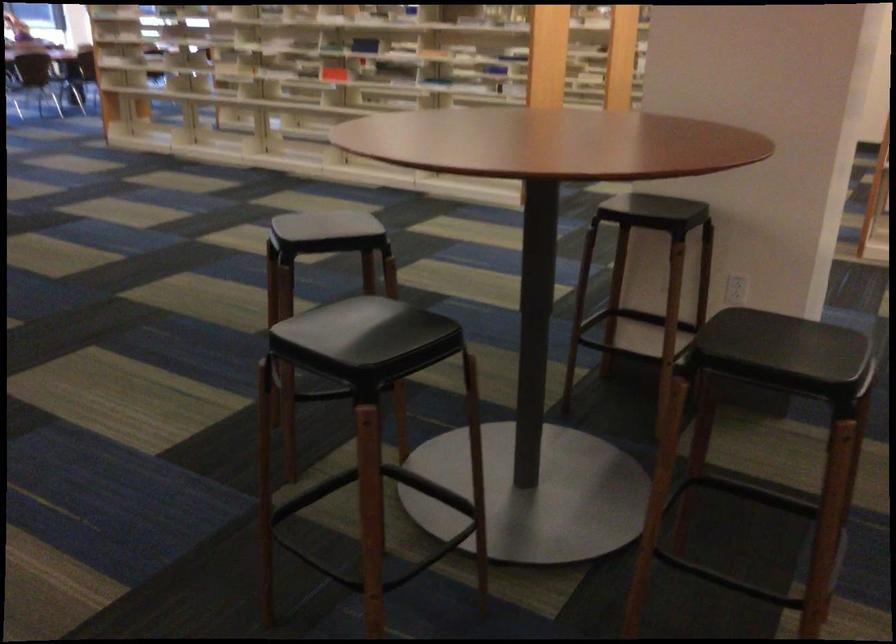
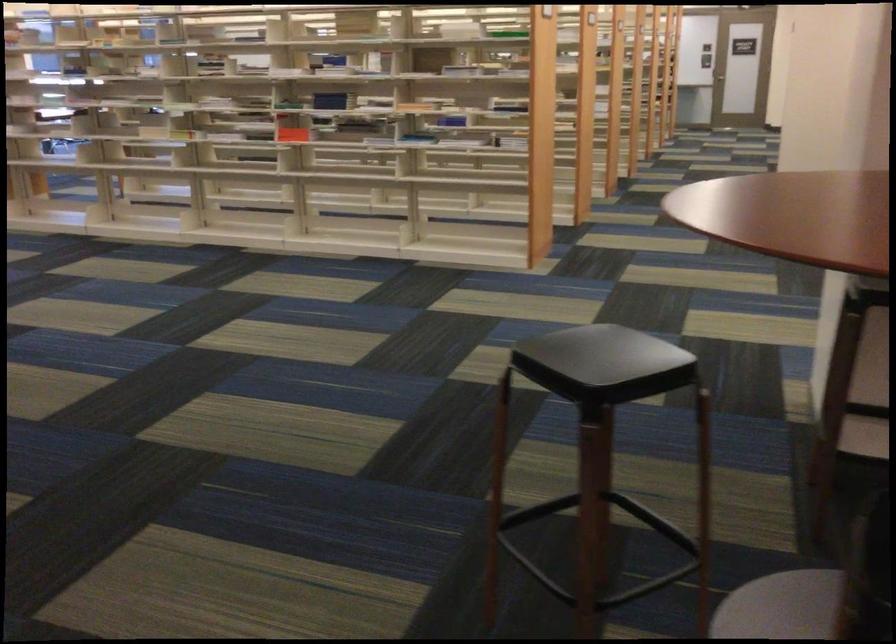
In the scene shown: In a continuous first-person perspective shot, in which direction is the camera moving?

The movement direction of the cameraman is left, forward.